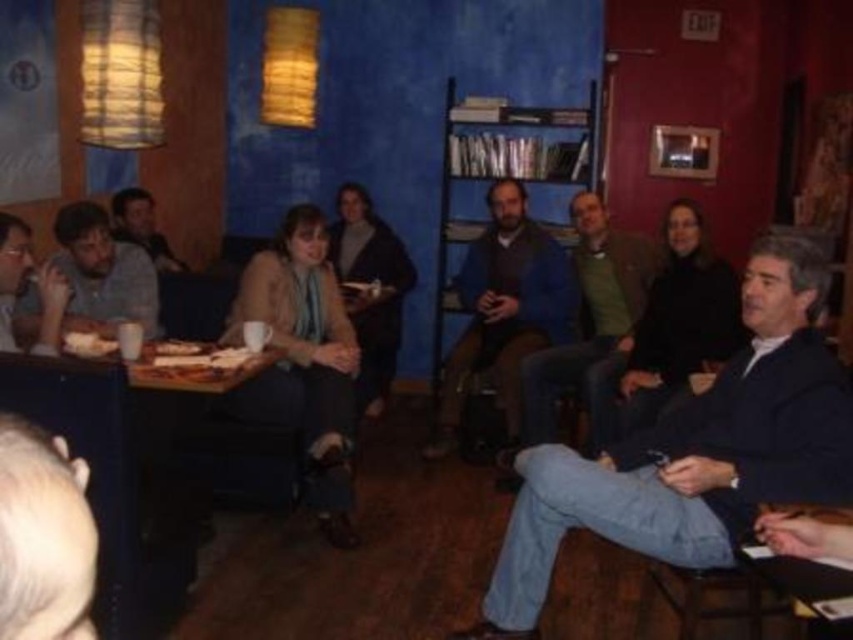
Does dark blue jacket at center have a greater height compared to matte gray shirt at left?

Yes, dark blue jacket at center is taller than matte gray shirt at left.

Where is `dark blue jacket at center`? This screenshot has width=853, height=640. dark blue jacket at center is located at coordinates point(503,310).

What are the coordinates of `dark blue jacket at center` in the screenshot? It's located at (503, 310).

Is matte black jacket at left positioned before matte gray shirt at left?

No, matte black jacket at left is behind matte gray shirt at left.

Can you confirm if matte black jacket at left is shorter than matte gray shirt at left?

No.

What do you see at coordinates (103, 273) in the screenshot? The width and height of the screenshot is (853, 640). I see `matte black jacket at left` at bounding box center [103, 273].

This screenshot has width=853, height=640. Identify the location of matte black jacket at left. (103, 273).

Is dark blue suit at center thinner than white paper plate at center?

Incorrect, dark blue suit at center's width is not less than white paper plate at center's.

Is point (544, 372) behind point (164, 346)?

Yes.

This screenshot has width=853, height=640. In order to click on dark blue suit at center in this screenshot , I will do `click(590, 326)`.